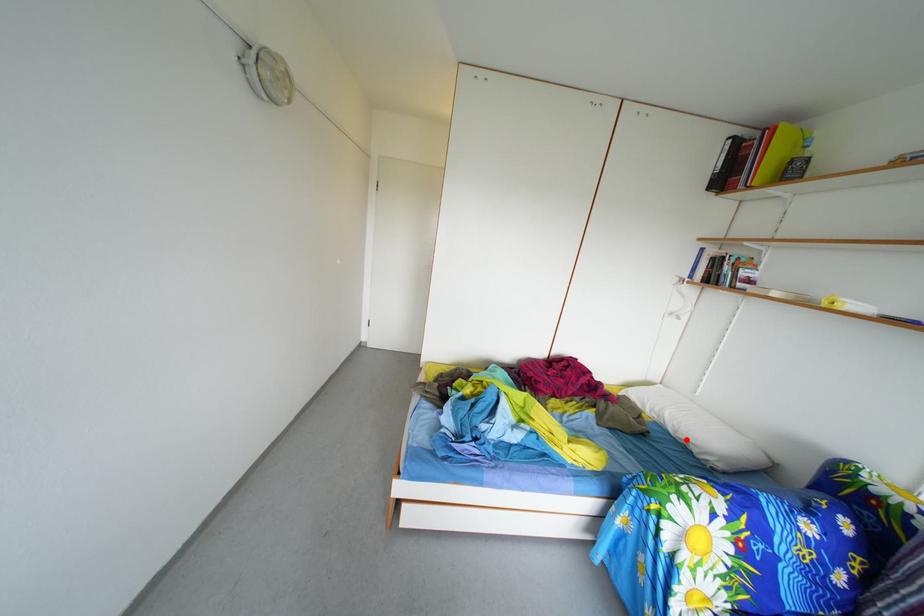
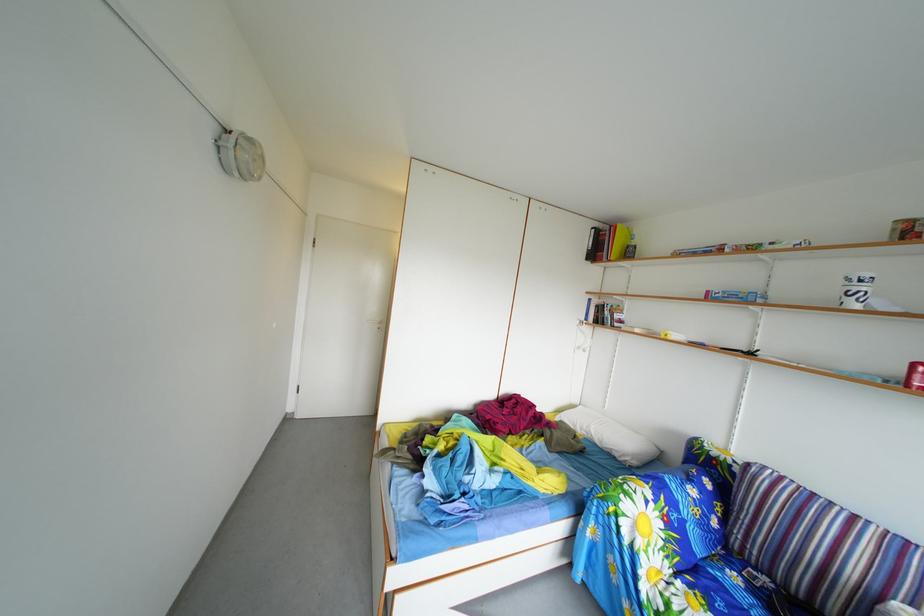
In the second image, find the point that corresponds to the highlighted location in the first image.

(612, 451)